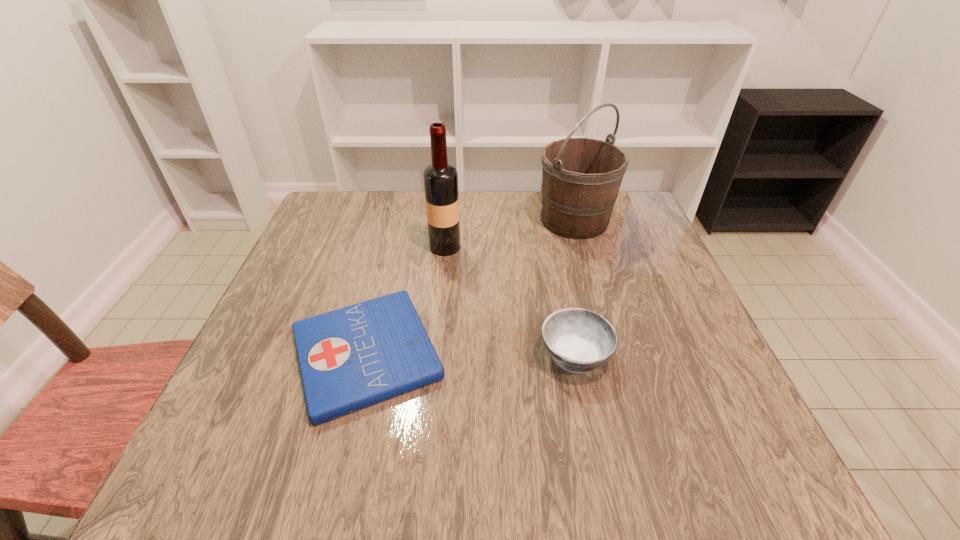
You are a GUI agent. You are given a task and a screenshot of the screen. Output one action in this format:
    pyautogui.click(x=<x>, y=<y>)
    Task: Click on the vacant space that satisfies the following two spatial constraints: 1. on the front side of the shortest object; 2. on the right side of the ashtray
    Image resolution: width=960 pixels, height=540 pixels.
    Given the screenshot: What is the action you would take?
    tap(366, 355)

At what (x,y) coordinates should I click in order to perform the action: click on vacant region that satisfies the following two spatial constraints: 1. on the back side of the bucket; 2. on the left side of the wine bottle. Please return your answer as a coordinate pair (x, y). This screenshot has width=960, height=540. Looking at the image, I should click on (447, 220).

Locate an element on the screen. This screenshot has height=540, width=960. vacant region that satisfies the following two spatial constraints: 1. on the back side of the bucket; 2. on the left side of the second shortest object is located at coordinates (547, 220).